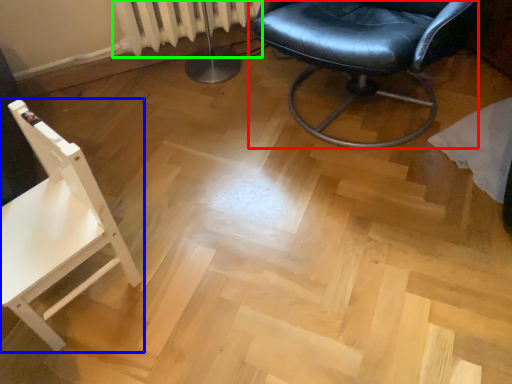
Question: Considering the real-world distances, which object is closest to chair (highlighted by a red box)? chair (highlighted by a blue box) or radiator (highlighted by a green box).

Choices:
 (A) chair
 (B) radiator

Answer: (B)